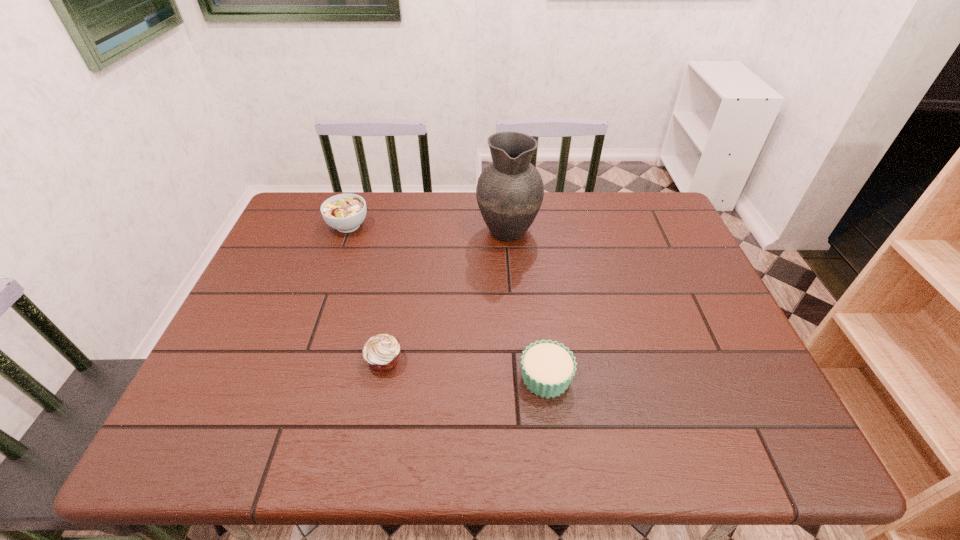
You are a GUI agent. You are given a task and a screenshot of the screen. Output one action in this format:
    pyautogui.click(x=<x>, y=<y>)
    Task: Click on the vacant space that satisfies the following two spatial constraints: 1. on the front side of the soup bowl; 2. on the right side of the cupcake
    
    Given the screenshot: What is the action you would take?
    pyautogui.click(x=295, y=377)

At what (x,y) coordinates should I click in order to perform the action: click on free space that satisfies the following two spatial constraints: 1. on the front side of the muffin; 2. on the left side of the leftmost object. Please return your answer as a coordinate pair (x, y). The width and height of the screenshot is (960, 540). Looking at the image, I should click on (300, 360).